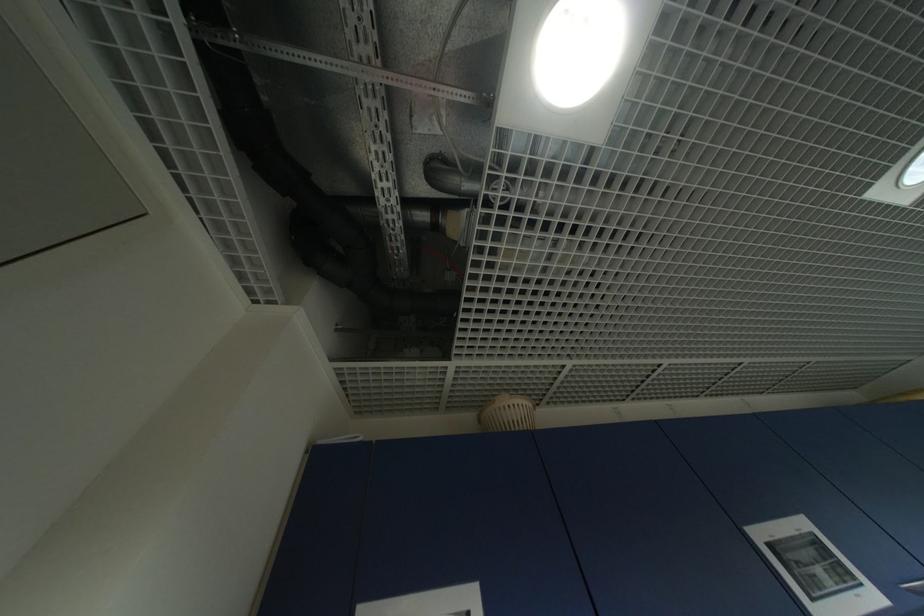
Where would you lift the small wicker basket? Please return your answer as a coordinate pair (x, y).

(506, 413)